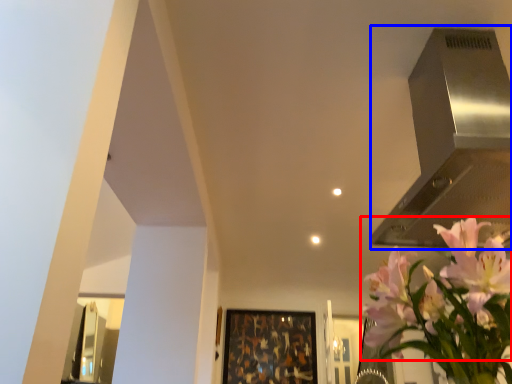
Question: Which point is further to the camera, flower (highlighted by a red box) or vent (highlighted by a blue box)?

Choices:
 (A) flower
 (B) vent

Answer: (B)